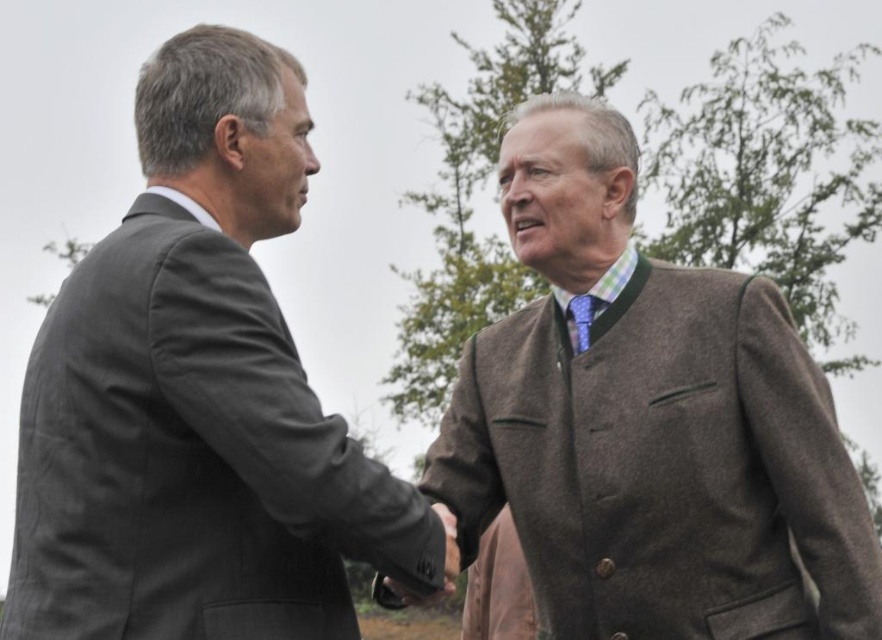
In the scene shown: You are a photographer adjusting your camera settings to focus on the brown woolen jacket at center and the smooth leather hand at center. Which object should you focus on first to ensure it appears sharp in the photo?

You should focus on the brown woolen jacket at center first because it is closer to the viewer than the smooth leather hand at center, ensuring it remains sharp in the photo.

You are a photographer setting up for an outdoor event. You need to ensure that the brown woolen jacket at center and the smooth leather hand at center are both clearly visible in the frame. Given their sizes, which object should you prioritize positioning closer to the camera to maintain clarity?

The smooth leather hand at center should be positioned closer to the camera because the brown woolen jacket at center is wider than it. This ensures the smaller object remains visible without being overshadowed by the larger one.